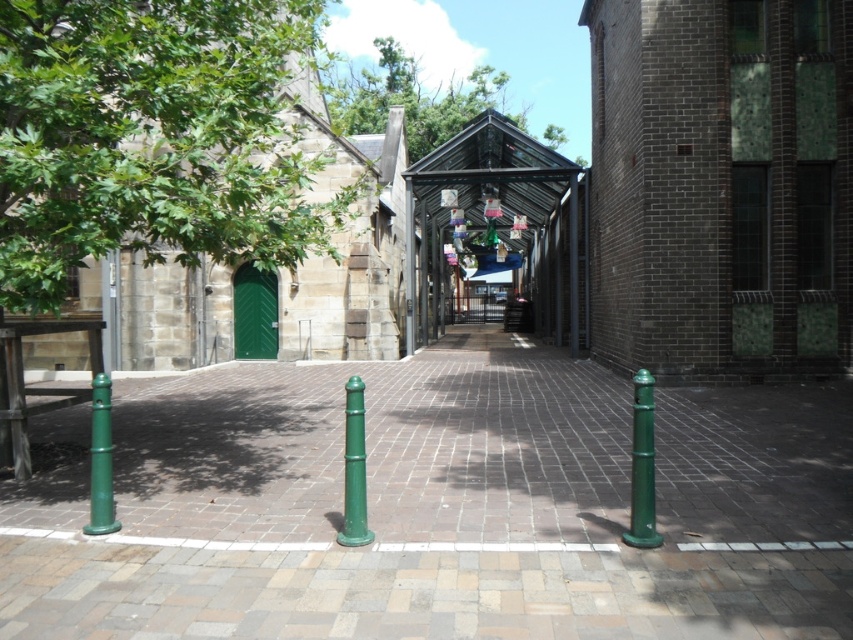
You are a delivery person carrying a package that requires a 2 meter clearance between the green matte post at center and the green matte post at left. Can you safely pass through the space between them?

The distance between the green matte post at center and the green matte post at left is 1.81 meters, which is less than the required 2 meters clearance. Therefore, you cannot safely pass through the space between them.

You are a delivery person with a cart that requires a 120 feet clearance to maneuver safely. You need to pass between the green polished concrete pavement at center and the green leafy tree at upper center. Is the distance sufficient for your cart?

The distance between the green polished concrete pavement at center and the green leafy tree at upper center is 118.24 feet, which is less than the required 120 feet clearance. Therefore, the cart cannot safely maneuver through this path.

What are the coordinates of the green leafy tree at upper left in the image?

The green leafy tree at upper left is located at coordinates [152,138].